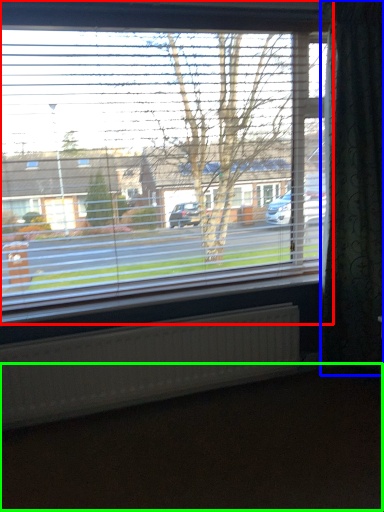
Question: Which is farther away from window (highlighted by a red box)? curtain (highlighted by a blue box) or dirt track (highlighted by a green box)?

Choices:
 (A) curtain
 (B) dirt track

Answer: (B)